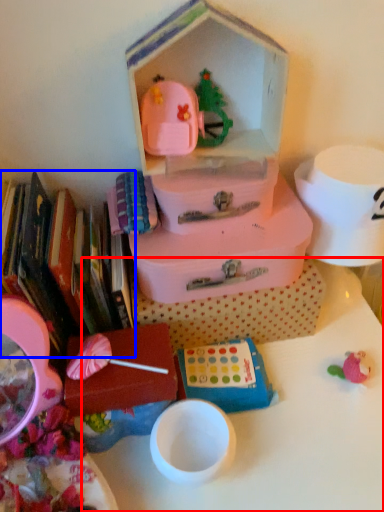
Question: Which of the following is the farthest to the observer, table (highlighted by a red box) or book (highlighted by a blue box)?

Choices:
 (A) table
 (B) book

Answer: (A)